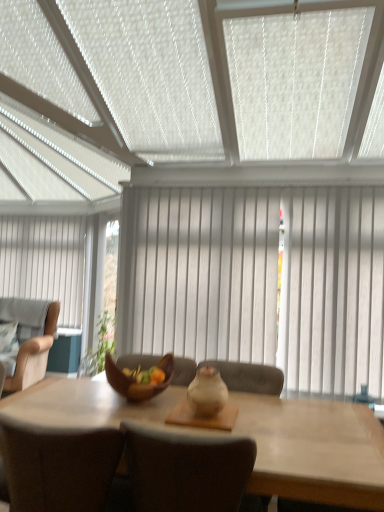
The width and height of the screenshot is (384, 512). Find the location of `free area below brown woven bowl at center (from a real-world perspective)`. free area below brown woven bowl at center (from a real-world perspective) is located at coordinates (148, 402).